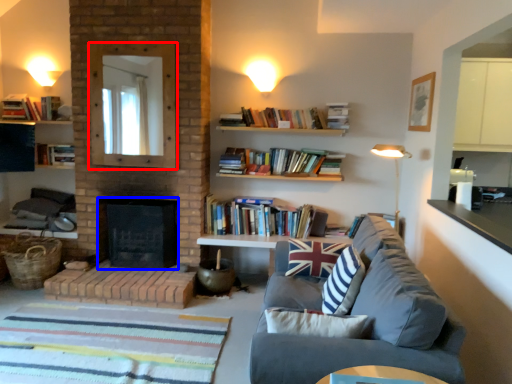
Question: Which object is further to the camera taking this photo, mirror (highlighted by a red box) or fireplace (highlighted by a blue box)?

Choices:
 (A) mirror
 (B) fireplace

Answer: (B)